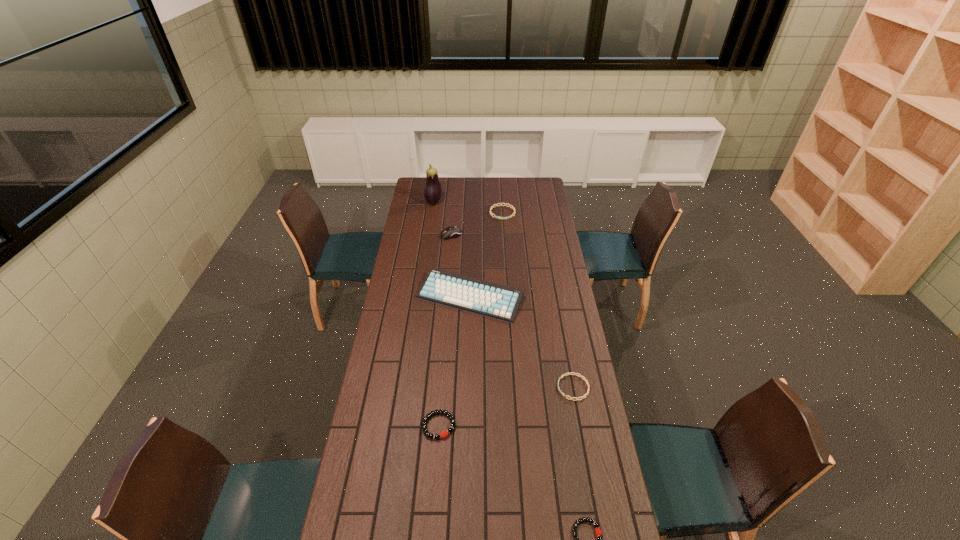
You are a GUI agent. You are given a task and a screenshot of the screen. Output one action in this format:
    pyautogui.click(x=<x>, y=<y>)
    Task: Click on the vacant area that lies between the bigger blue bracelet and the eggplant
    
    Given the screenshot: What is the action you would take?
    pyautogui.click(x=468, y=207)

This screenshot has height=540, width=960. Find the location of `free space between the bigger blue bracelet and the nearer blue bracelet`. free space between the bigger blue bracelet and the nearer blue bracelet is located at coordinates (538, 300).

Identify which object is located as the second nearest to the bigger black bracelet. Please provide its 2D coordinates. Your answer should be formatted as a tuple, i.e. [(x, y)], where the tuple contains the x and y coordinates of a point satisfying the conditions above.

[(498, 301)]

Where is `object that stands as the sixth closest to the farthest bracelet`? The height and width of the screenshot is (540, 960). object that stands as the sixth closest to the farthest bracelet is located at coordinates (598, 532).

Locate an element on the screen. bracelet that is the second closest to the tallest object is located at coordinates [x=563, y=375].

Locate an element on the screen. bracelet that stands as the third closest to the farther blue bracelet is located at coordinates (598, 532).

Locate an element on the screen. Image resolution: width=960 pixels, height=540 pixels. blue bracelet that stands as the second closest to the computer keyboard is located at coordinates (492, 207).